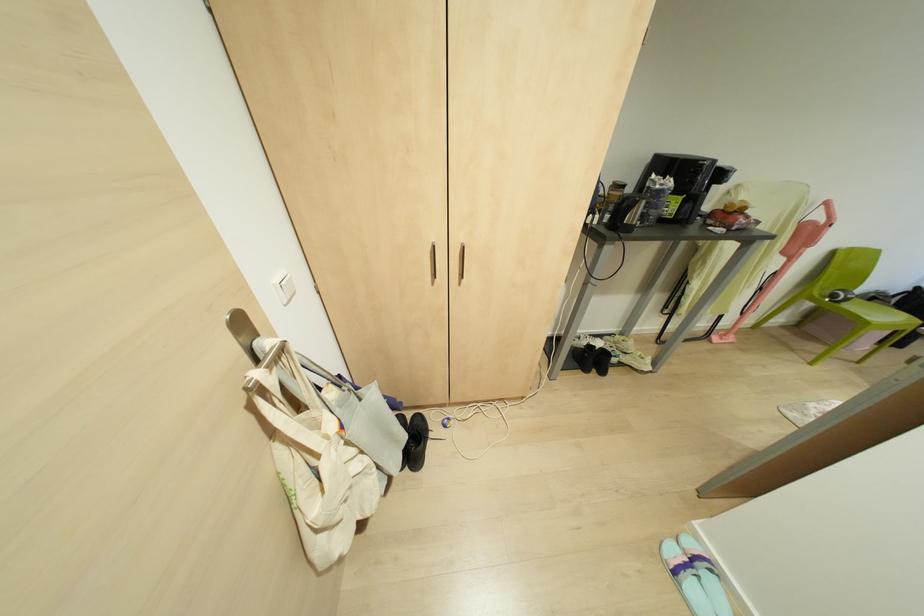
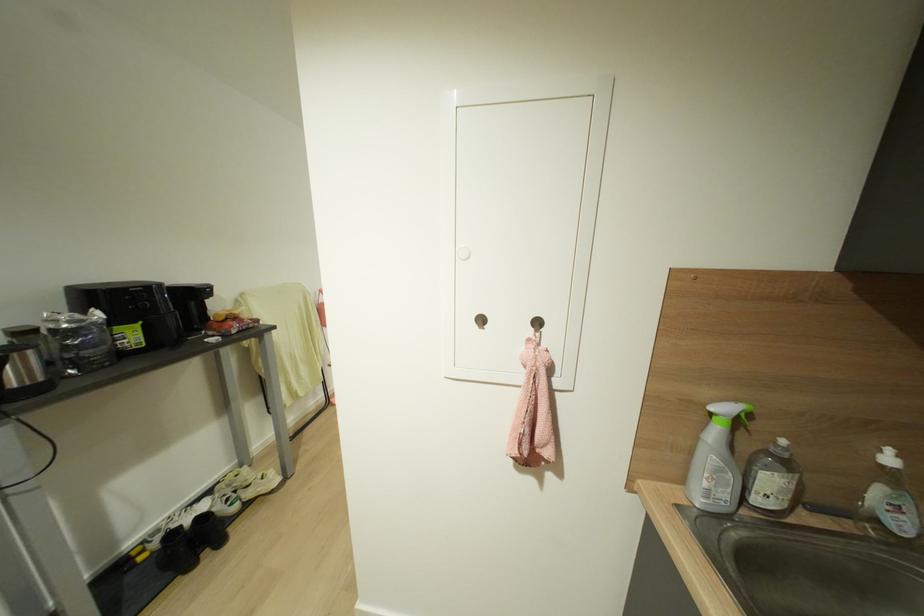
Question: The first image is from the beginning of the video and the second image is from the end. How did the camera likely rotate when shooting the video?

Choices:
 (A) Left
 (B) Right
 (C) Up
 (D) Down

Answer: (B)